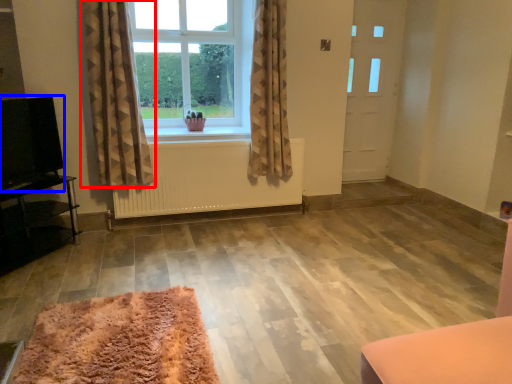
Question: Which of the following is the closest to the observer, curtain (highlighted by a red box) or level (highlighted by a blue box)?

Choices:
 (A) curtain
 (B) level

Answer: (B)